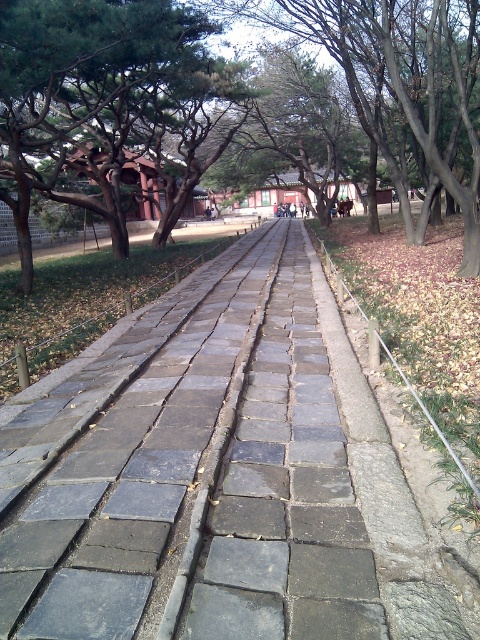
You are standing on the gray stone pavement at center and want to reach the green leafy tree at center. Which direction should you walk to get closer to the tree?

The gray stone pavement at center is smaller than the green leafy tree at center, which indicates that the tree is closer to the observer. Therefore, to reach the green leafy tree at center, you should walk forward towards it since it is nearer.

You are standing at the entrance of the pathway and want to walk straight ahead. Based on the image, where is the gray stone pavement at center located in terms of direction from your current position?

The gray stone pavement at center is located at point 0.744 along the x axis and 0.452 along the y axis, so it is ahead and slightly to the right of your current position.